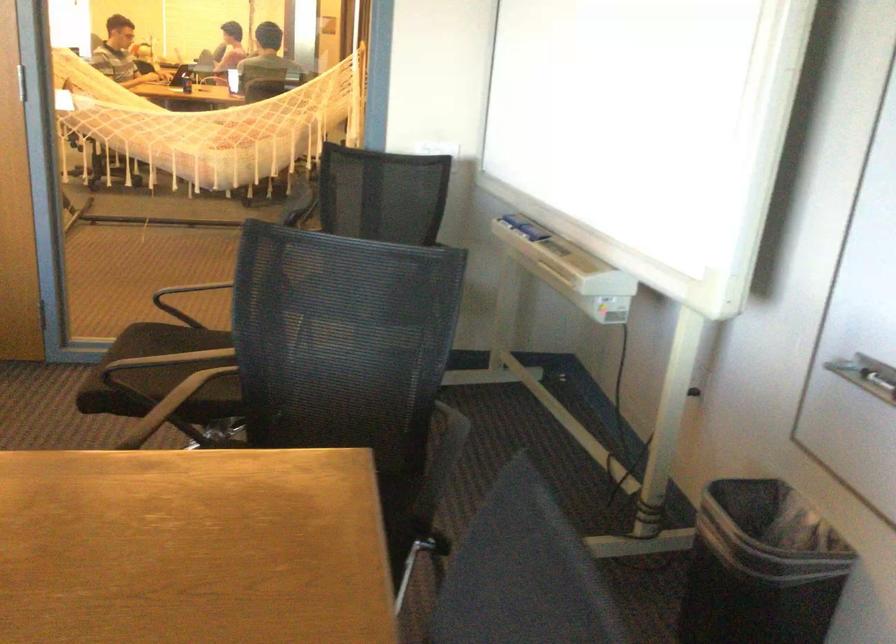
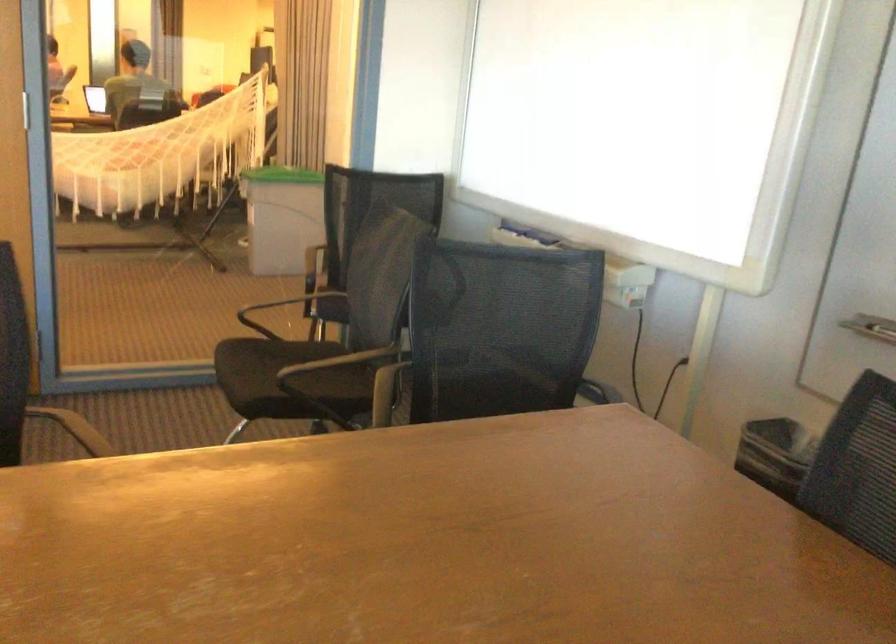
Where in the second image is the point corresponding to point (170, 375) from the first image?

(288, 379)